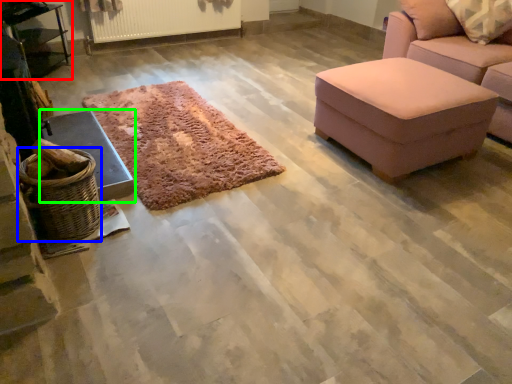
Question: Which object is the farthest from table (highlighted by a red box)? Choose among these: basket (highlighted by a blue box) or furniture (highlighted by a green box).

Choices:
 (A) basket
 (B) furniture

Answer: (A)